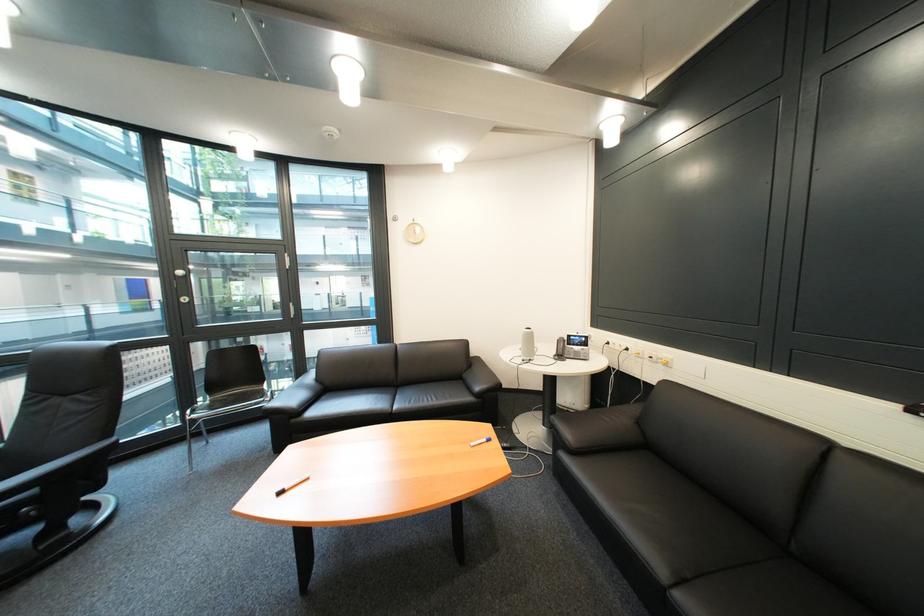
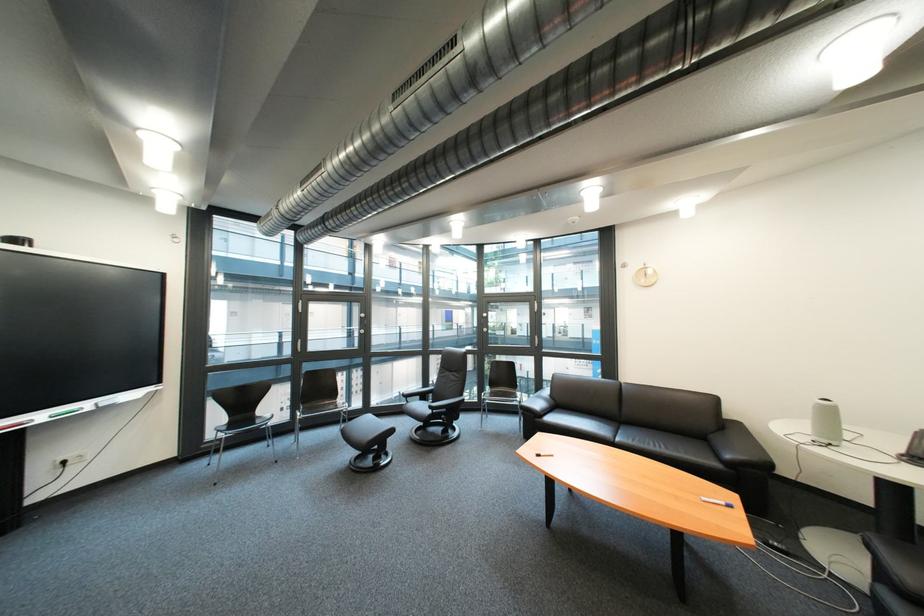
Question: I am providing you with two images of the same scene from different viewpoints. Please identify which objects are invisible in image2.

Choices:
 (A) green whiteboard marker
 (B) black leather footrest
 (C) grey cylindrical speaker
 (D) none of these

Answer: (D)